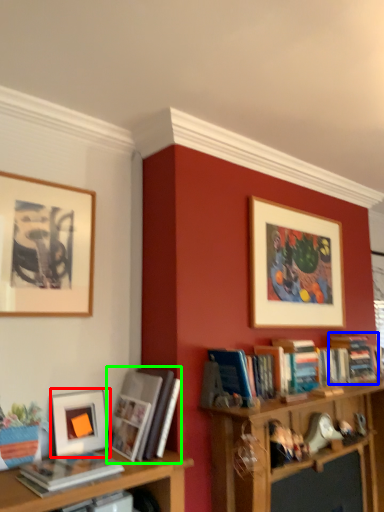
Question: Which object is positioned farthest from picture frame (highlighted by a red box)? Select from book (highlighted by a blue box) and book (highlighted by a green box).

Choices:
 (A) book
 (B) book

Answer: (A)